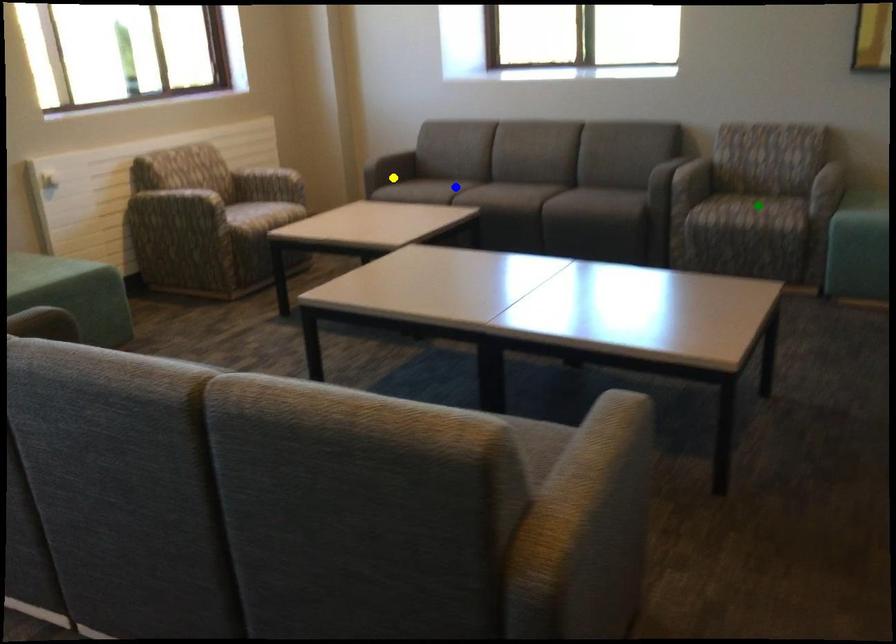
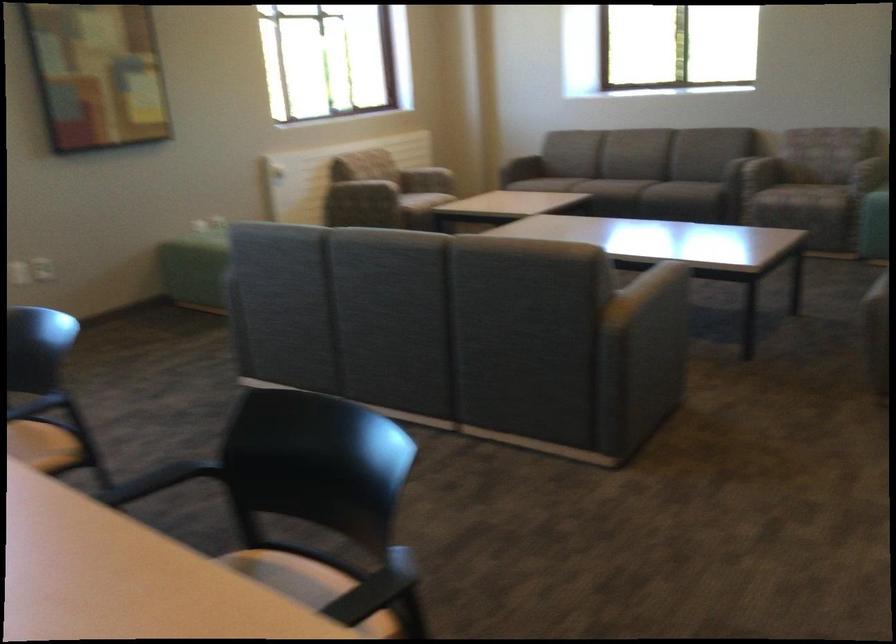
I am providing you with two images of the same scene from different viewpoints. Three points are marked in image1. Which point corresponds to a part or object that is occluded in image2?In image1, three points are marked. Which of them correspond to a part or object that is occluded in image2?Among the three points shown in image1, which one corresponds to a part or object that is no longer visible due to occlusion in image2?

blue point